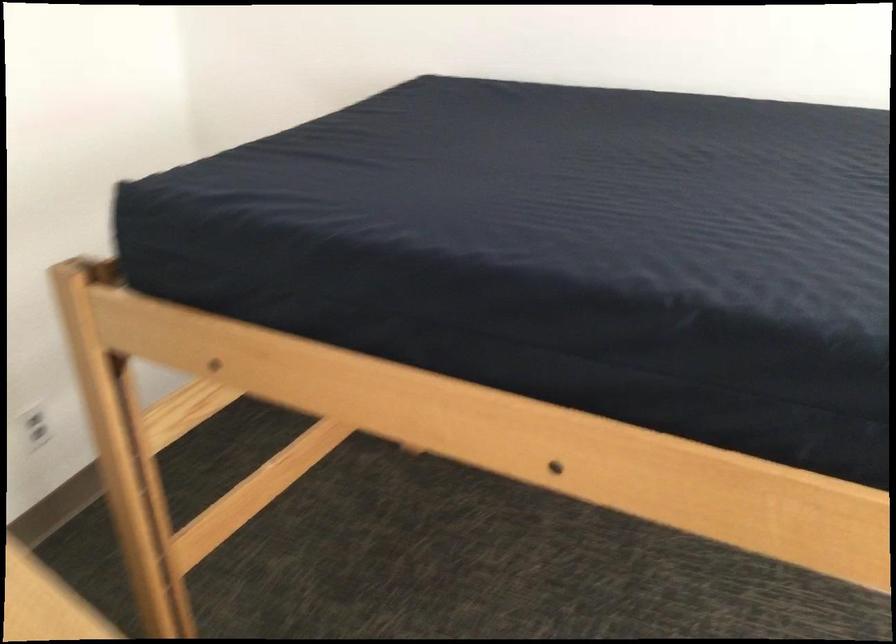
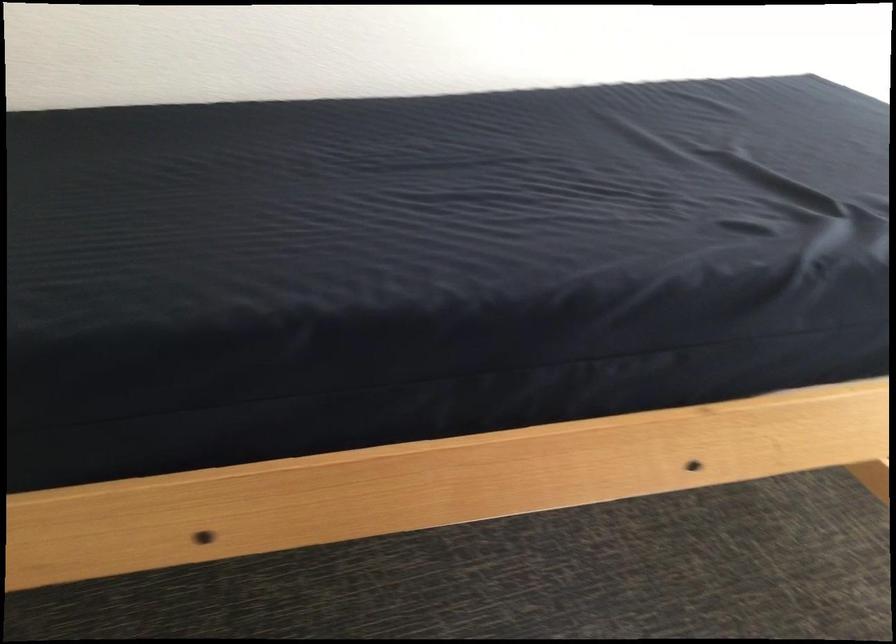
Question: Based on the continuous images, in which direction is the camera rotating? Reply with the corresponding letter.

Choices:
 (A) Left
 (B) Right
 (C) Up
 (D) Down

Answer: (B)